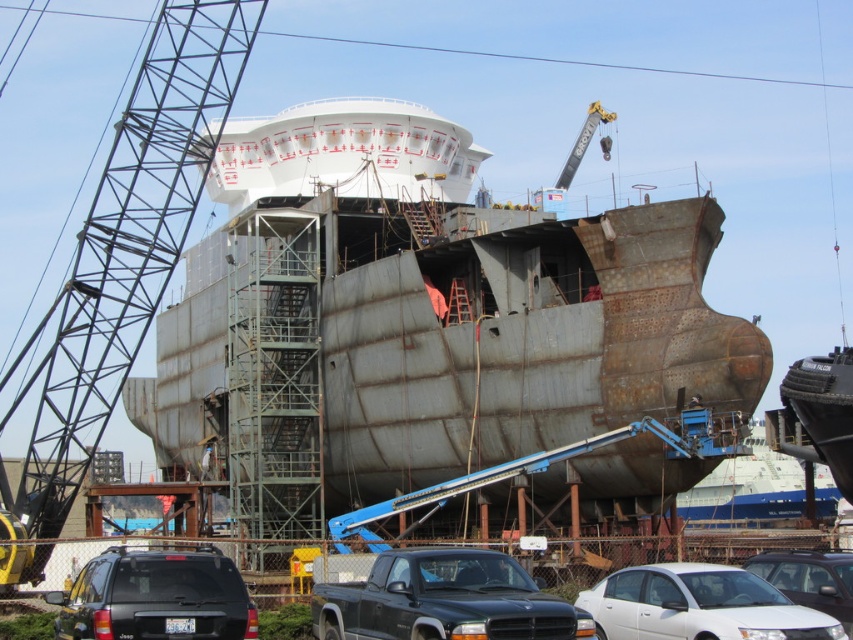
Question: Which of the following is the closest to the observer?

Choices:
 (A) (676, 392)
 (B) (103, 625)
 (C) (395, 580)

Answer: (B)

Question: Which point appears closest to the camera in this image?

Choices:
 (A) (515, 406)
 (B) (167, 570)
 (C) (799, 486)

Answer: (B)

Question: In this image, where is black matte suv at lower left located relative to white matte sedan at lower right?

Choices:
 (A) left
 (B) right

Answer: (A)

Question: Considering the relative positions of rusty metal ship at center and rusty metal ship at lower right in the image provided, where is rusty metal ship at center located with respect to rusty metal ship at lower right?

Choices:
 (A) below
 (B) above

Answer: (B)

Question: Is rusty metal crane at left below black matte suv at lower left?

Choices:
 (A) no
 (B) yes

Answer: (A)

Question: Which point appears closest to the camera in this image?

Choices:
 (A) (641, 616)
 (B) (274, 154)
 (C) (543, 602)
 (D) (757, 497)

Answer: (C)